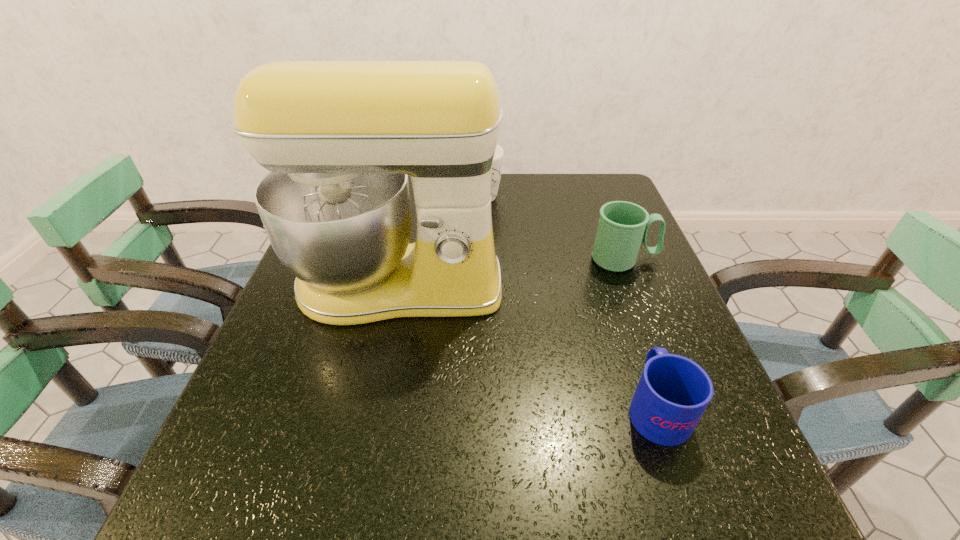
You are a GUI agent. You are given a task and a screenshot of the screen. Output one action in this format:
    pyautogui.click(x=<x>, y=<y>)
    Task: Click on the tallest object
    The height and width of the screenshot is (540, 960).
    Given the screenshot: What is the action you would take?
    pyautogui.click(x=340, y=138)

Where is `the farthest object`? the farthest object is located at coordinates (498, 156).

Where is `the farthest mug`? the farthest mug is located at coordinates (498, 156).

In order to click on the second nearest mug in this screenshot , I will do `click(623, 226)`.

I want to click on the nearest mug, so click(x=673, y=392).

Find the location of a particular element. the shortest mug is located at coordinates (673, 392).

Where is `free space located 0.180m on the side of the tallest object with the control knob`? The image size is (960, 540). free space located 0.180m on the side of the tallest object with the control knob is located at coordinates (372, 413).

Where is `free location located on the side of the farthest mug with the handle`? free location located on the side of the farthest mug with the handle is located at coordinates (547, 197).

The height and width of the screenshot is (540, 960). I want to click on vacant space located 0.270m on the side with the handle of the nearest mug, so click(612, 276).

Locate an element on the screen. This screenshot has height=540, width=960. free spot located 0.400m on the side with the handle of the nearest mug is located at coordinates (600, 242).